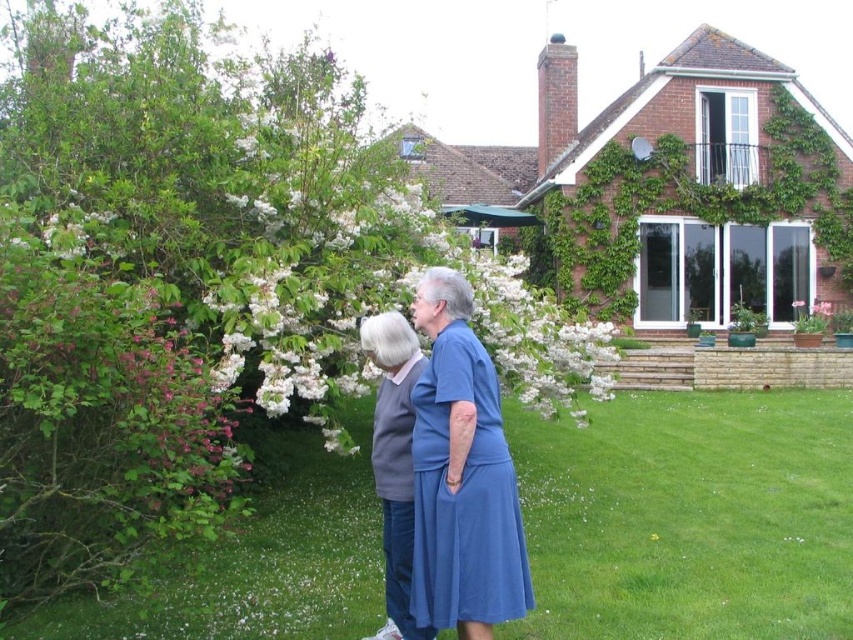
You are a photographer trying to capture both the white blossoms at upper center and the pink matte flower at center in a single frame. Based on their positions and sizes, which flower should you focus on to ensure both are clearly visible in your photo?

The white blossoms at upper center might be wider than the pink matte flower at center, so focusing on the white blossoms at upper center would help ensure both are clearly visible in the photo.

You are a photographer planning to capture a photo of the green grass at center and the blue fabric dress at center. Based on their heights, which one should you focus on first if you want to ensure both are in focus?

The green grass at center is shorter than the blue fabric dress at center, so you should focus on the blue fabric dress at center first to ensure both are in focus.